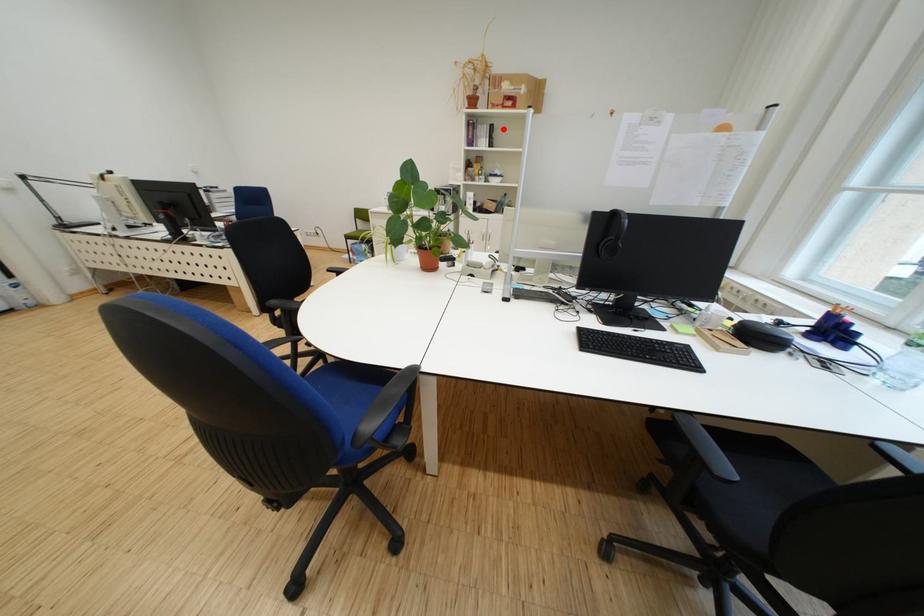
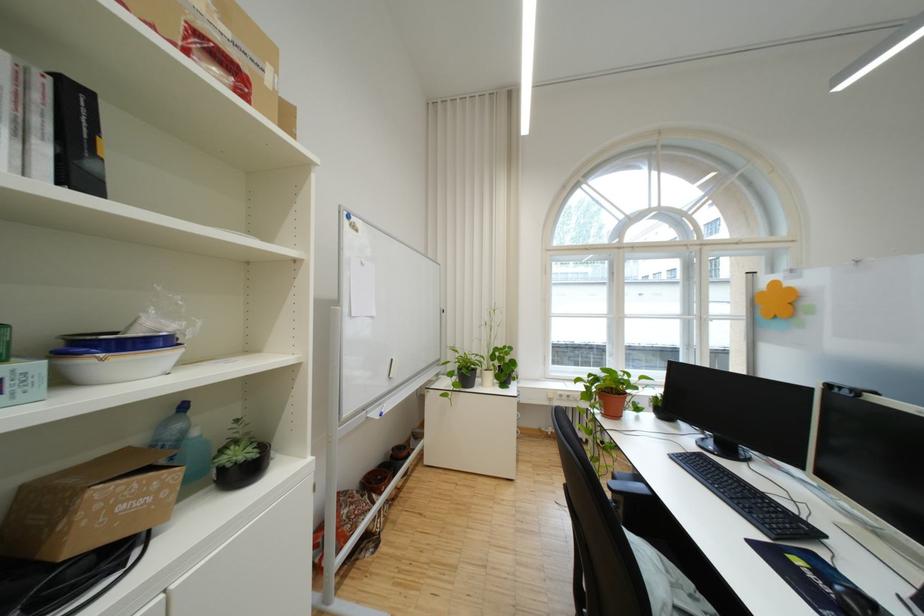
The point at the highlighted location is marked in the first image. Where is the corresponding point in the second image?

(88, 100)